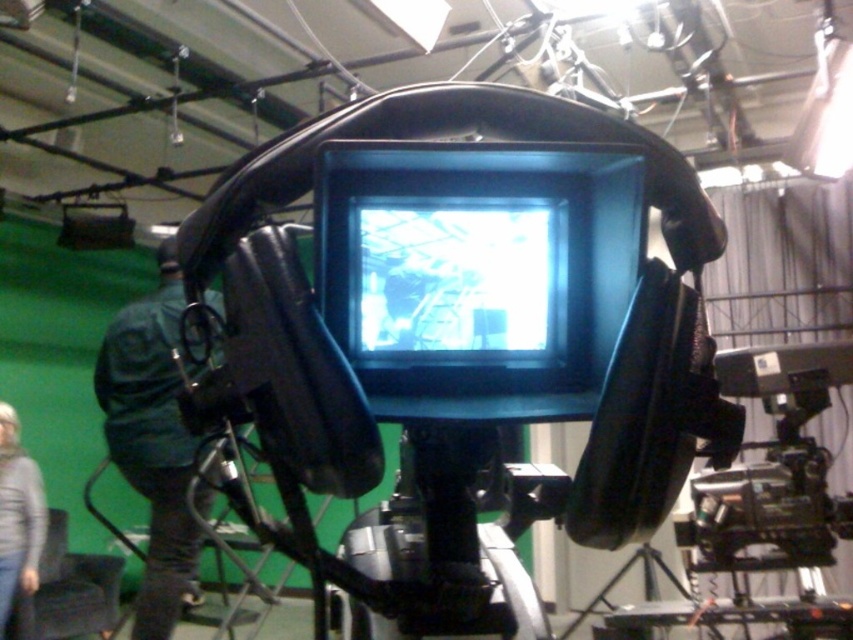
Is black plastic screen at center above black plastic video camera at lower right?

Indeed, black plastic screen at center is positioned over black plastic video camera at lower right.

Is black plastic screen at center bigger than black plastic video camera at lower right?

No, black plastic screen at center is not bigger than black plastic video camera at lower right.

Locate an element on the screen. black plastic screen at center is located at coordinates (479, 273).

Which is more to the left, black plastic video camera at lower right or denim jacket at lower left?

Positioned to the left is denim jacket at lower left.

Looking at this image, does black plastic video camera at lower right have a smaller size compared to denim jacket at lower left?

Correct, black plastic video camera at lower right occupies less space than denim jacket at lower left.

The width and height of the screenshot is (853, 640). Identify the location of black plastic video camera at lower right. (773, 467).

Can you confirm if black plastic screen at center is bigger than denim jacket at lower left?

Actually, black plastic screen at center might be smaller than denim jacket at lower left.

What do you see at coordinates (479, 273) in the screenshot?
I see `black plastic screen at center` at bounding box center [479, 273].

Which is behind, point (381, 166) or point (10, 541)?

The point (10, 541) is more distant.

Identify the location of black plastic screen at center. (479, 273).